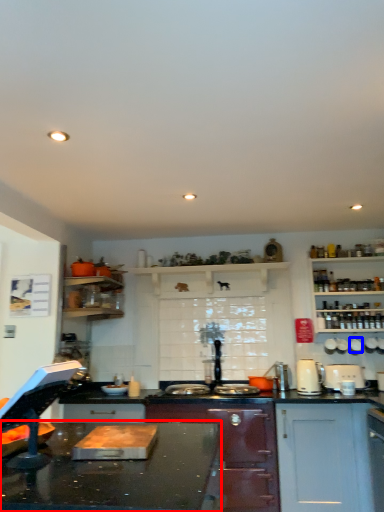
Question: Which point is further to the camera, countertop (highlighted by a red box) or appliance (highlighted by a blue box)?

Choices:
 (A) countertop
 (B) appliance

Answer: (B)